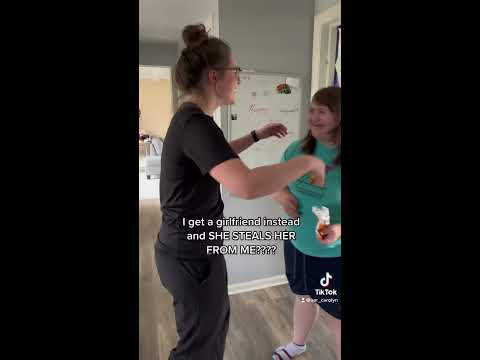
You are a GUI agent. You are given a task and a screenshot of the screen. Output one action in this format:
    pyautogui.click(x=<x>, y=<y>)
    Task: Click on the wall
    This screenshot has height=360, width=480.
    Given the screenshot: What is the action you would take?
    pyautogui.click(x=267, y=40)